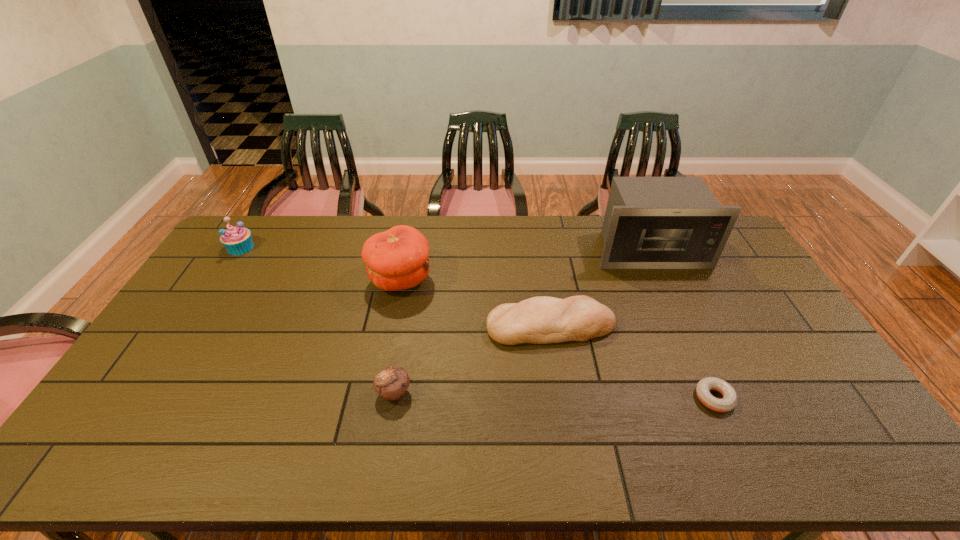
Find the location of a particular element. This screenshot has height=540, width=960. object positioned at the far right corner is located at coordinates (650, 222).

Locate an element on the screen. This screenshot has width=960, height=540. vacant area at the far edge is located at coordinates (536, 242).

The height and width of the screenshot is (540, 960). I want to click on vacant space at the near edge of the desktop, so click(440, 465).

Locate an element on the screen. Image resolution: width=960 pixels, height=540 pixels. free space at the left edge of the desktop is located at coordinates (129, 381).

The width and height of the screenshot is (960, 540). In the image, there is a desktop. Find the location of `vacant space at the far left corner`. vacant space at the far left corner is located at coordinates (278, 226).

The image size is (960, 540). I want to click on free space that is in between the tallest object and the shortest object, so click(x=682, y=324).

Identify the location of free space that is in between the shorter muffin and the leftmost object. (317, 320).

This screenshot has width=960, height=540. Identify the location of free space between the tallest object and the doughnut. 682,324.

The height and width of the screenshot is (540, 960). I want to click on unoccupied position between the tallest object and the shortest object, so click(682, 324).

Where is `empty space that is in between the microwave oven and the bread`? The height and width of the screenshot is (540, 960). empty space that is in between the microwave oven and the bread is located at coordinates (600, 288).